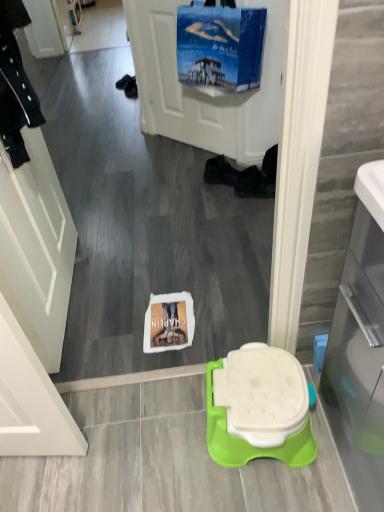
You are a GUI agent. You are given a task and a screenshot of the screen. Output one action in this format:
    pyautogui.click(x=<x>, y=<y>)
    Task: Click on the vacant location behind black fabric shoe at center, which is the second footwear from right to left
    This screenshot has height=512, width=384.
    Given the screenshot: What is the action you would take?
    pyautogui.click(x=200, y=160)